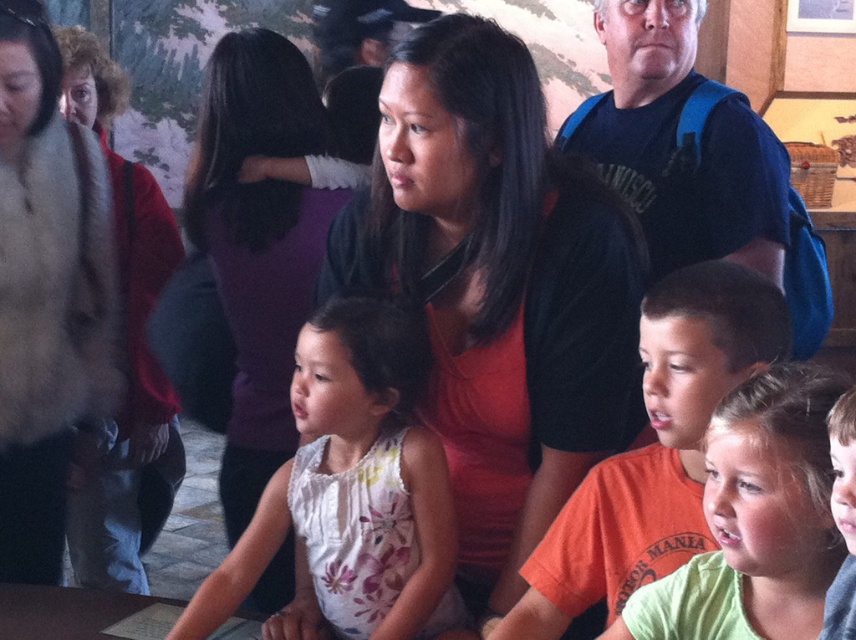
You are a photographer at the event and want to capture a photo that includes both the matte brown fur coat at left and the blue fabric backpack at upper right. Which object should you focus on first to ensure both are in sharp focus?

The matte brown fur coat at left is closer to the viewer than the blue fabric backpack at upper right. To ensure both are in sharp focus, focus on the matte brown fur coat at left first, as it is the closer object.

You are a photographer trying to capture a group photo of the purple fabric at center and the green cotton shirt at center. The camera you have can only focus on objects within a 3 feet range. Can you take a photo of both objects in focus without moving the camera?

The purple fabric at center and green cotton shirt at center are 3.77 feet apart from each other, which exceeds the camera focus range of 3 feet. Therefore, you cannot take a photo of both objects in focus without moving the camera.

Looking at this image, you are organizing a clothing donation drive and need to decide which item to place in a small box that can only accommodate items narrower than 30 cm. You have the green cotton shirt at center and the blue fabric backpack at upper right. Based on their widths, which item should you choose for the box?

The green cotton shirt at center has a width less than the blue fabric backpack at upper right, so you should choose the green cotton shirt at center for the small box since it is narrower and will fit better.